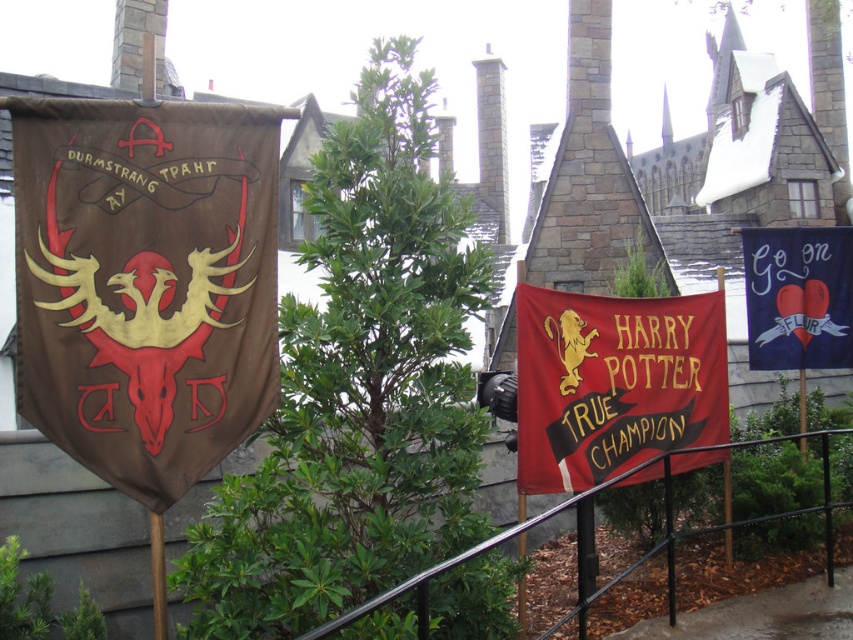
Question: From the image, what is the correct spatial relationship of brown leather banner at left in relation to navy blue fabric banner at upper right?

Choices:
 (A) left
 (B) right

Answer: (A)

Question: Can you confirm if red velvet banner at center is positioned above black metal fence at lower center?

Choices:
 (A) yes
 (B) no

Answer: (A)

Question: Which object appears farthest from the camera in this image?

Choices:
 (A) brown leather banner at left
 (B) navy blue fabric banner at upper right

Answer: (B)

Question: Does brown leather banner at left appear under red velvet banner at center?

Choices:
 (A) yes
 (B) no

Answer: (B)

Question: Estimate the real-world distances between objects in this image. Which object is farther from the black metal fence at lower center?

Choices:
 (A) navy blue fabric banner at upper right
 (B) brown leather banner at left

Answer: (B)

Question: Which point is farther to the camera?

Choices:
 (A) (647, 337)
 (B) (387, 593)

Answer: (A)